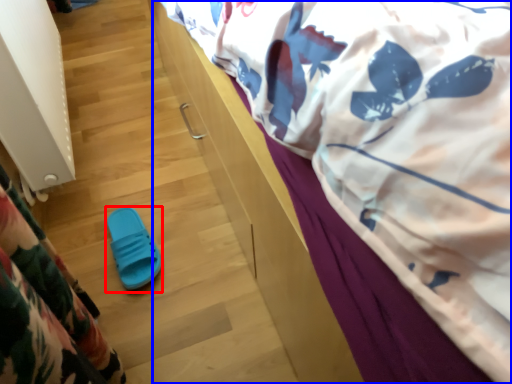
Question: Which point is further to the camera, footwear (highlighted by a red box) or bed (highlighted by a blue box)?

Choices:
 (A) footwear
 (B) bed

Answer: (A)